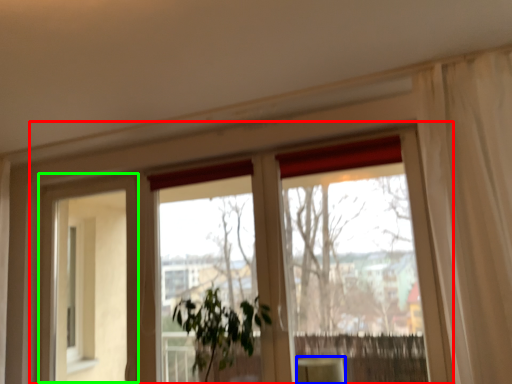
Question: Considering the real-world distances, which object is farthest from window (highlighted by a red box)? furniture (highlighted by a blue box) or screen door (highlighted by a green box)?

Choices:
 (A) furniture
 (B) screen door

Answer: (A)